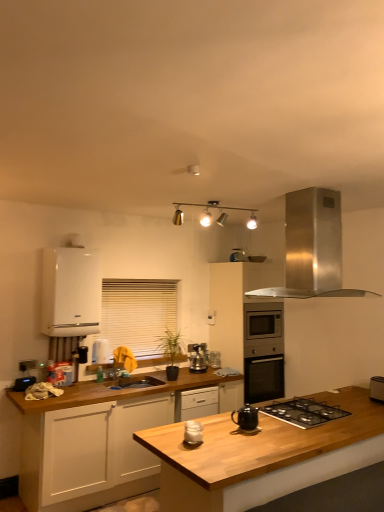
In order to click on blank space situated above metallic track lighting at upper center (from a real-world perspective) in this screenshot , I will do pos(220,200).